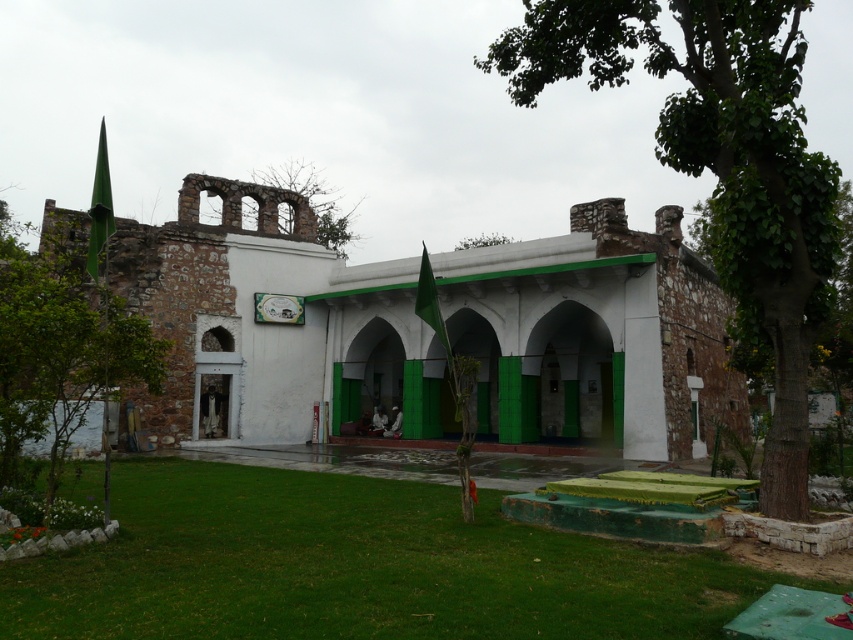
You are a visitor to this peaceful mosque area. You see the green leafy tree at left and the bare branches at upper center. Which one would cast a bigger shadow during the day?

The green leafy tree at left has a larger size compared to the bare branches at upper center, so it would cast a bigger shadow during the day.

You are a visitor standing at the entrance of the mosque. You notice the green grass at lower center and the green leafy tree at upper center. Which object is positioned higher in the scene?

The green leafy tree at upper center is positioned higher in the scene than the green grass at lower center.